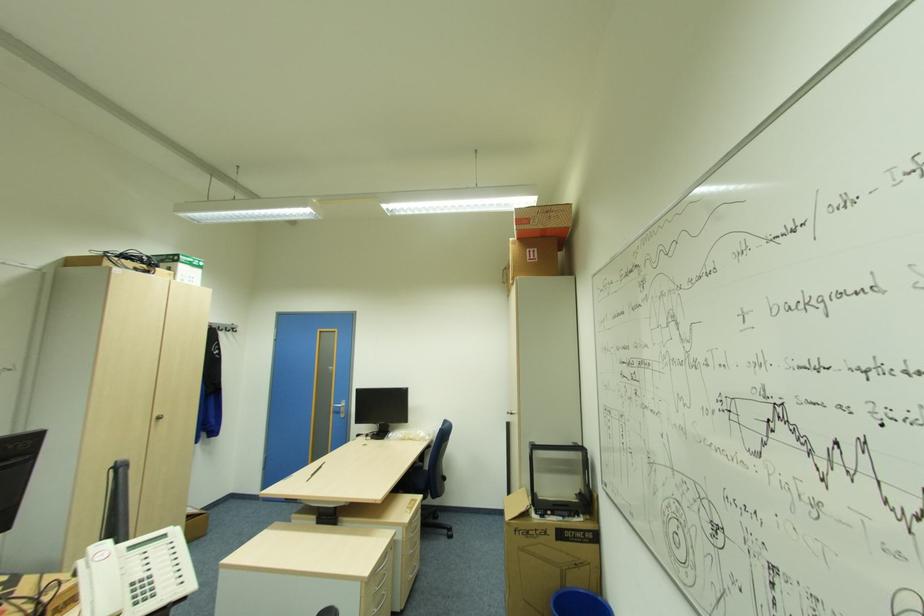
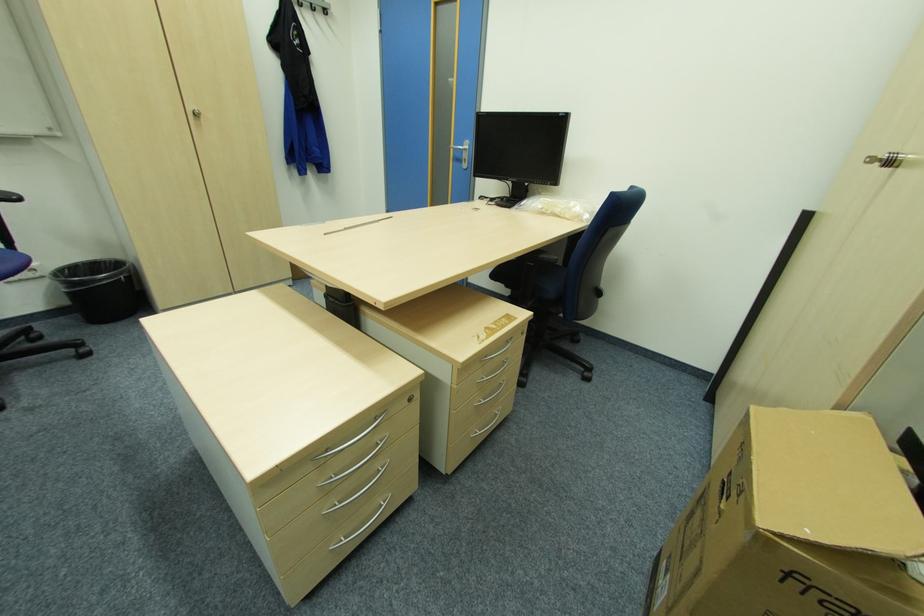
Where in the second image is the point corresponding to [415,576] from the first image?

(482, 432)